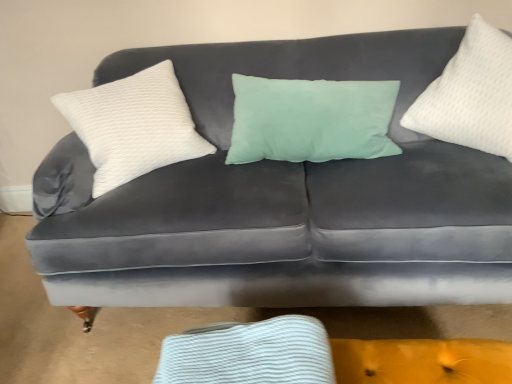
Question: Is white textured pillow at right, which appears as the second pillow when viewed from the left, taller or shorter than white textured pillow at left, acting as the first pillow starting from the left?

Choices:
 (A) tall
 (B) short

Answer: (A)

Question: Does point (429, 107) appear closer or farther from the camera than point (202, 152)?

Choices:
 (A) closer
 (B) farther

Answer: (A)

Question: Is white textured pillow at right, which appears as the second pillow when viewed from the left, wider or thinner than white textured pillow at left, acting as the first pillow starting from the left?

Choices:
 (A) wide
 (B) thin

Answer: (B)

Question: In terms of size, does white textured pillow at left, acting as the first pillow starting from the left, appear bigger or smaller than white textured pillow at right, the 1th pillow from the right?

Choices:
 (A) small
 (B) big

Answer: (B)

Question: In the image, is white textured pillow at left, acting as the first pillow starting from the left, on the left side or the right side of white textured pillow at right, the 1th pillow from the right?

Choices:
 (A) left
 (B) right

Answer: (A)

Question: Relative to white textured pillow at right, which appears as the second pillow when viewed from the left, is white textured pillow at left, acting as the first pillow starting from the left, in front or behind?

Choices:
 (A) behind
 (B) front

Answer: (A)

Question: From a real-world perspective, is white textured pillow at left, arranged as the second pillow when viewed from the right, positioned above or below white textured pillow at right, the 1th pillow from the right?

Choices:
 (A) above
 (B) below

Answer: (B)